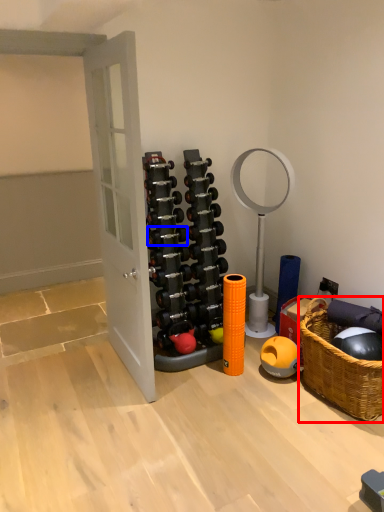
Question: Among these objects, which one is farthest to the camera, picnic basket (highlighted by a red box) or dumbbell (highlighted by a blue box)?

Choices:
 (A) picnic basket
 (B) dumbbell

Answer: (B)